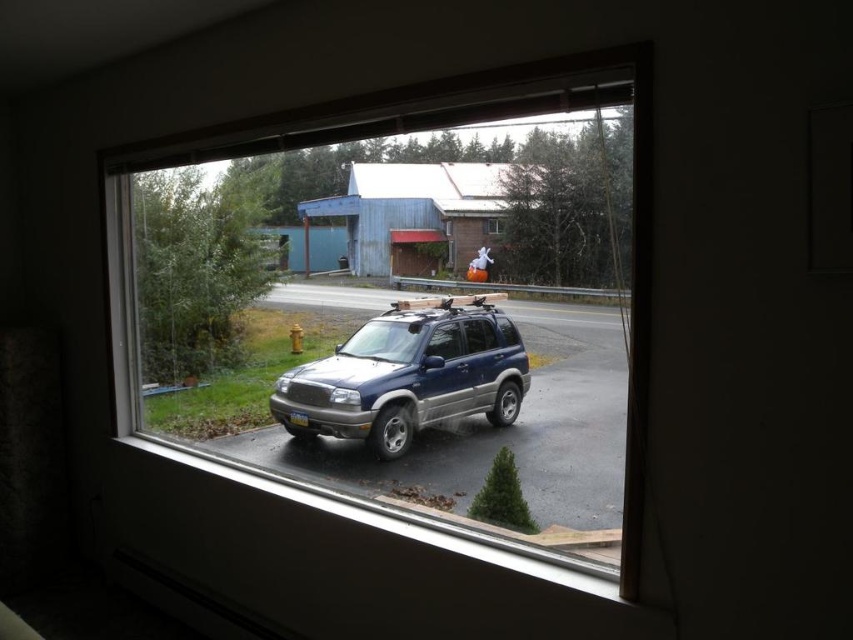
Question: Which point is closer to the camera?

Choices:
 (A) (335, 198)
 (B) (503, 230)

Answer: (B)

Question: Which of the following is the closest to the observer?

Choices:
 (A) transparent glass window at center
 (B) satin blue suv at center

Answer: (B)

Question: Does satin blue suv at center appear over transparent glass window at center?

Choices:
 (A) yes
 (B) no

Answer: (B)

Question: Does clear glass window at center appear on the left side of transparent glass window at center?

Choices:
 (A) yes
 (B) no

Answer: (A)

Question: Which point is closer to the camera?

Choices:
 (A) satin blue suv at center
 (B) clear glass window at center

Answer: (B)

Question: Can you confirm if satin blue suv at center is positioned to the left of transparent glass window at center?

Choices:
 (A) no
 (B) yes

Answer: (B)